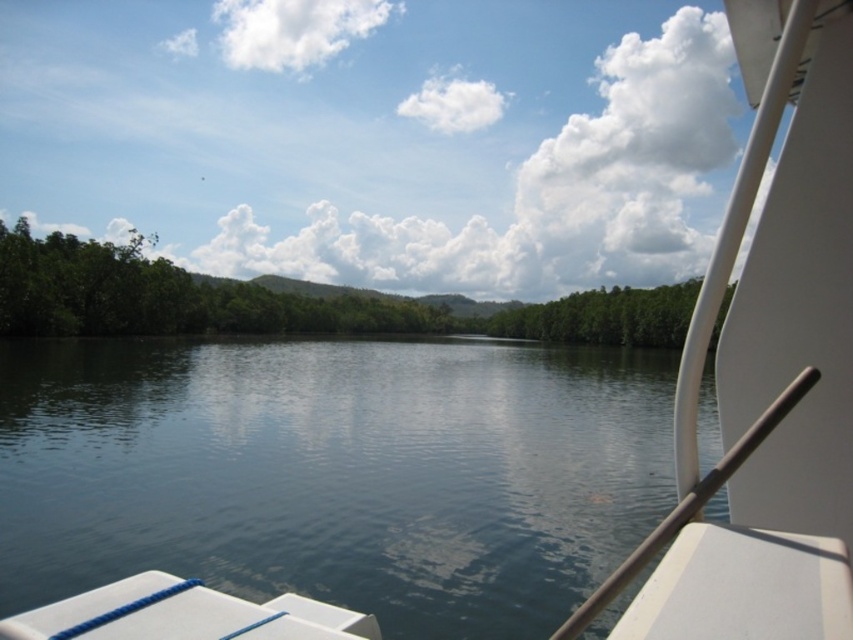
You are navigating a boat in a tropical area. You see a point marked at coordinates (769, 372). What object is located at that point?

The point at coordinates (769, 372) marks the white glossy boat at upper right.

You are on a boat and want to know if the white glossy boat at upper right is located below the green leafy trees at left. Can you confirm this based on the scene?

Yes, the white glossy boat at upper right is positioned under the green leafy trees at left according to the scene description.